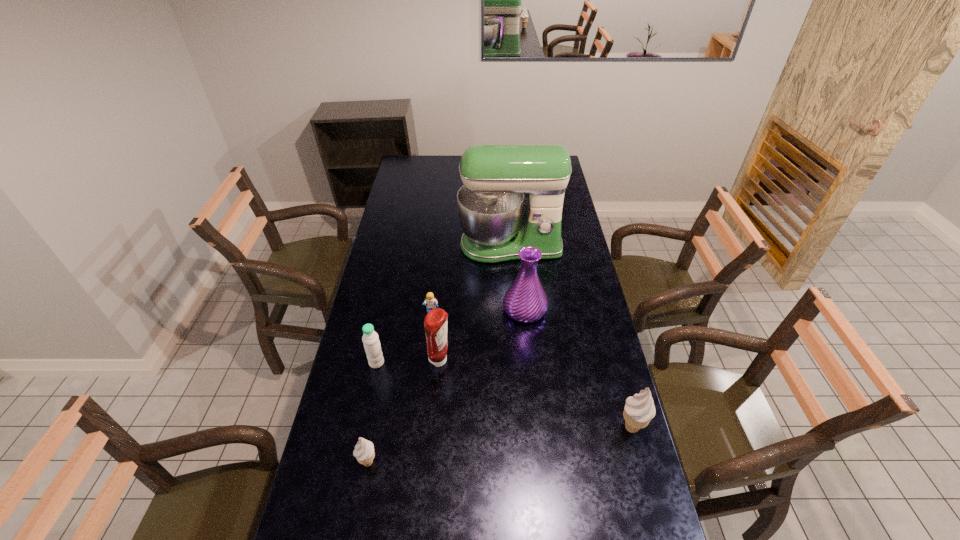
Please point a space for a new icecream to maintain equal intervals. Please provide its 2D coordinates. Your answer should be formatted as a tuple, i.e. [(x, y)], where the tuple contains the x and y coordinates of a point satisfying the conditions above.

[(504, 445)]